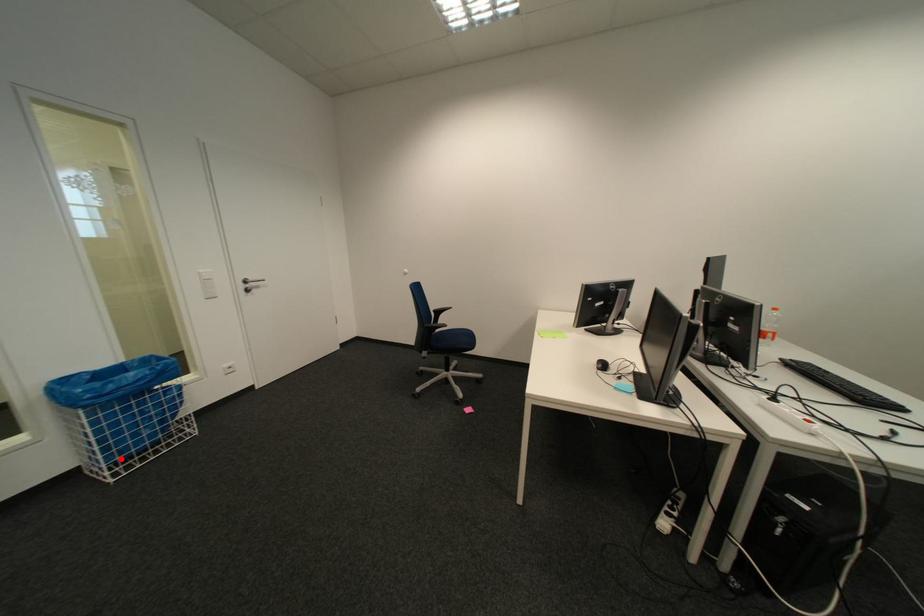
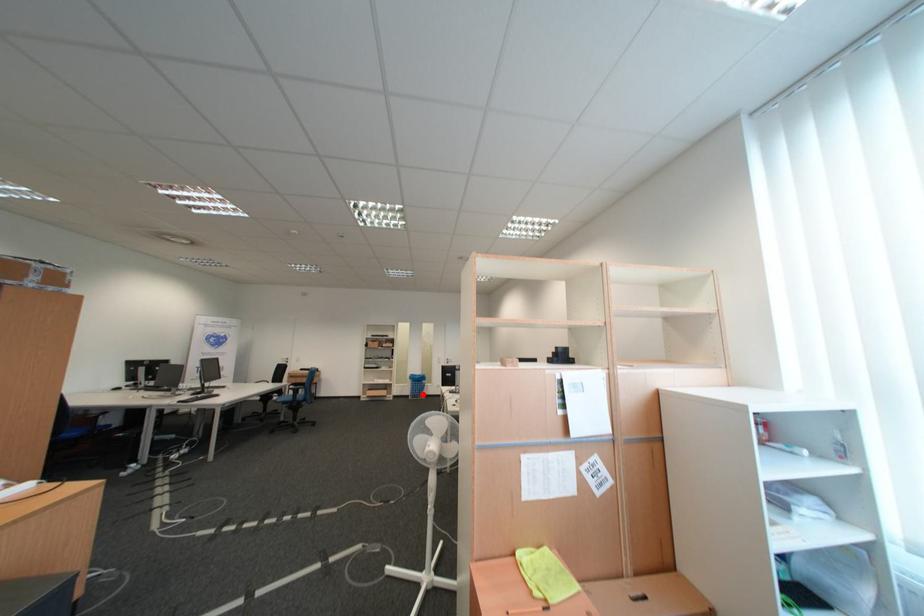
I am providing you with two images of the same scene from different viewpoints. A red point is marked on the first image and another point is marked on the second image. Is the marked point in image1 the same physical position as the marked point in image2?

Yes